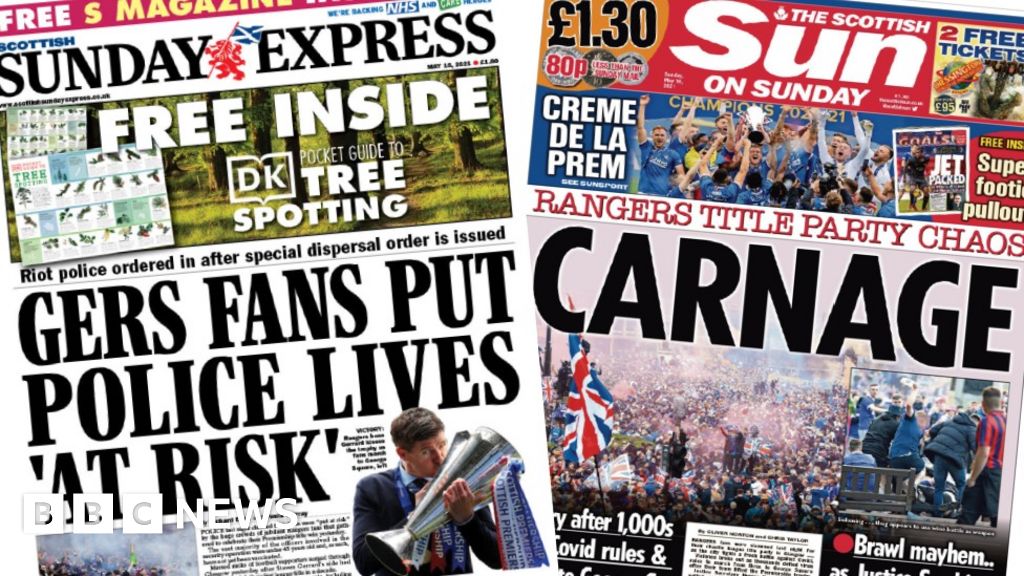
Where is `trophy`? This screenshot has width=1024, height=576. trophy is located at coordinates (487, 450), (760, 113).